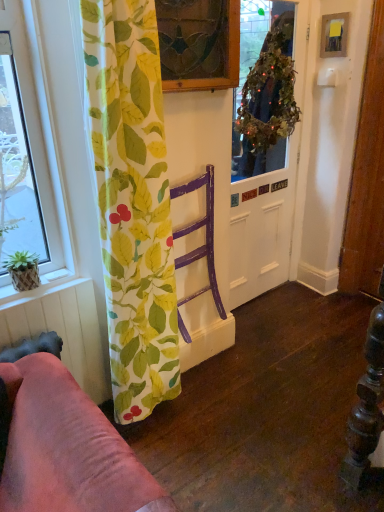
Question: From the image's perspective, does green leafy wreath at upper center appear lower than purple wood chair at center?

Choices:
 (A) no
 (B) yes

Answer: (A)

Question: Considering the relative sizes of green leafy wreath at upper center and purple wood chair at center in the image provided, is green leafy wreath at upper center smaller than purple wood chair at center?

Choices:
 (A) yes
 (B) no

Answer: (B)

Question: Can you confirm if green leafy wreath at upper center is bigger than purple wood chair at center?

Choices:
 (A) no
 (B) yes

Answer: (B)

Question: Is green leafy wreath at upper center oriented away from purple wood chair at center?

Choices:
 (A) yes
 (B) no

Answer: (B)

Question: Is the position of green leafy wreath at upper center less distant than that of purple wood chair at center?

Choices:
 (A) no
 (B) yes

Answer: (A)

Question: Considering their positions, is green leaf-patterned fabric at left located in front of or behind green leafy wreath at upper center?

Choices:
 (A) front
 (B) behind

Answer: (A)

Question: From a real-world perspective, is green leaf-patterned fabric at left physically located above or below green leafy wreath at upper center?

Choices:
 (A) below
 (B) above

Answer: (A)

Question: Would you say green leaf-patterned fabric at left is to the left or to the right of green leafy wreath at upper center in the picture?

Choices:
 (A) right
 (B) left

Answer: (B)

Question: Considering the positions of green leaf-patterned fabric at left and green leafy wreath at upper center in the image, is green leaf-patterned fabric at left bigger or smaller than green leafy wreath at upper center?

Choices:
 (A) big
 (B) small

Answer: (A)

Question: Looking at the image, does metallic silver picture frame at upper right seem bigger or smaller compared to purple wood chair at center?

Choices:
 (A) small
 (B) big

Answer: (A)

Question: Considering the positions of point [326, 26] and point [187, 230], is point [326, 26] closer or farther from the camera than point [187, 230]?

Choices:
 (A) closer
 (B) farther

Answer: (B)

Question: In terms of height, does metallic silver picture frame at upper right look taller or shorter compared to purple wood chair at center?

Choices:
 (A) short
 (B) tall

Answer: (A)

Question: In the image, is metallic silver picture frame at upper right positioned in front of or behind purple wood chair at center?

Choices:
 (A) front
 (B) behind

Answer: (B)

Question: Is green woven basket at lower left bigger or smaller than green leafy wreath at center?

Choices:
 (A) big
 (B) small

Answer: (B)

Question: Is green woven basket at lower left taller or shorter than green leafy wreath at center?

Choices:
 (A) tall
 (B) short

Answer: (B)